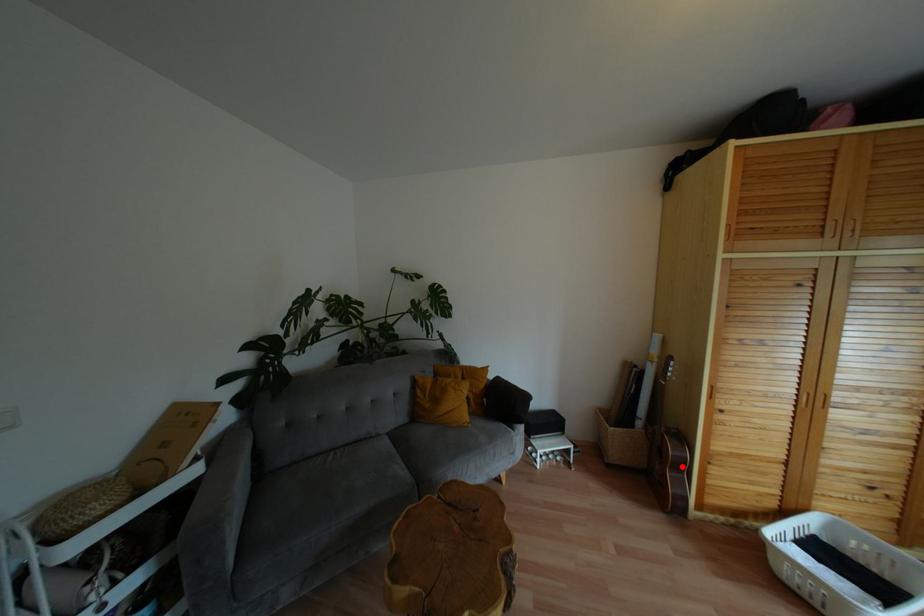
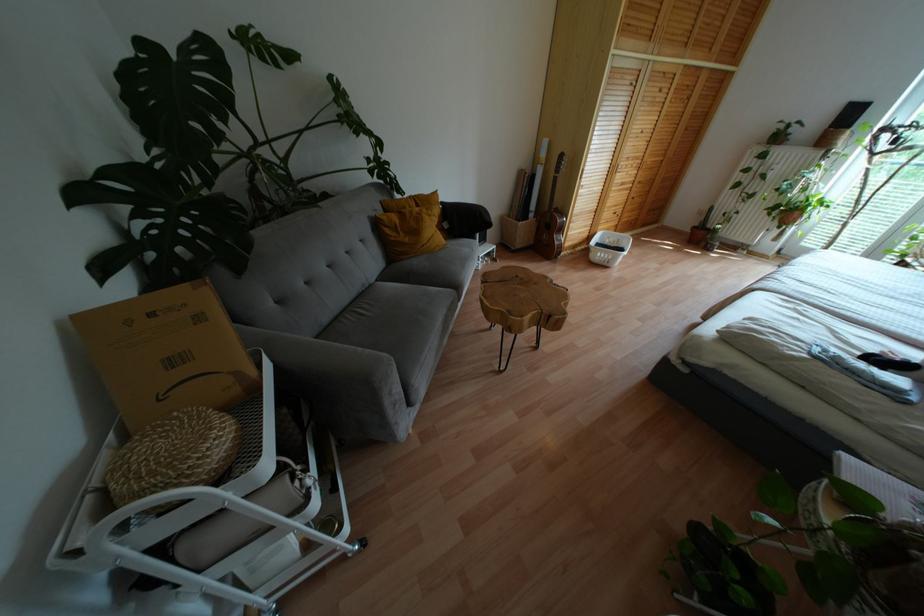
Question: I am providing you with two images of the same scene from different viewpoints. A red point is shown in image1. For the corresponding object point in image2, is it positioned nearer or farther from the camera?

Choices:
 (A) Nearer
 (B) Farther

Answer: (A)